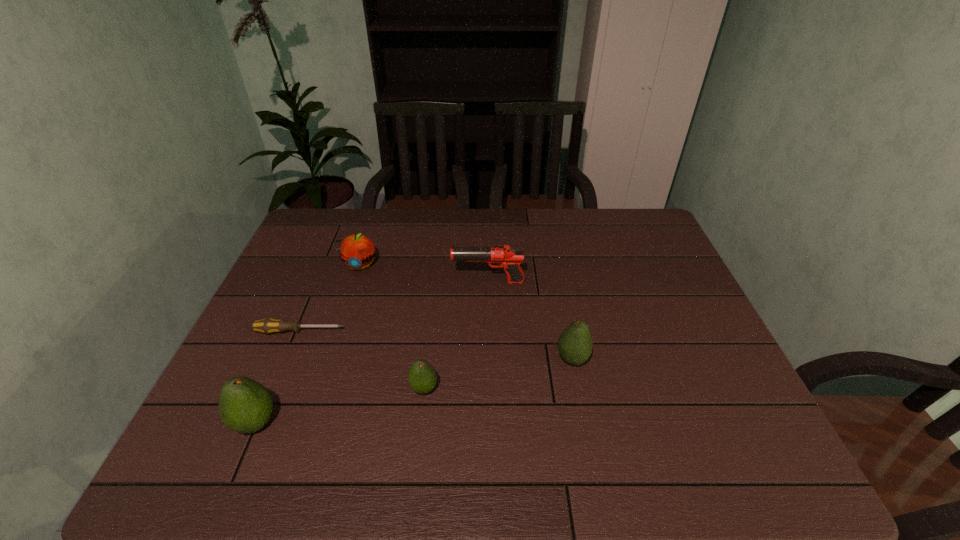
What are the coordinates of `blank region between the tallest avocado and the screwdriver` in the screenshot? It's located at (277, 377).

Find the location of a particular element. vacant area that lies between the shortest object and the fifth object from left to right is located at coordinates [394, 307].

This screenshot has height=540, width=960. In order to click on free space between the leftmost avocado and the third farthest object in this screenshot , I will do `click(277, 377)`.

Locate an element on the screen. empty location between the leftmost avocado and the second farthest avocado is located at coordinates (340, 406).

I want to click on empty location between the gun and the fourth farthest object, so click(530, 320).

What are the coordinates of `vacant area that lies between the nearest avocado and the screwdriver` in the screenshot? It's located at (277, 377).

Find the location of a particular element. The image size is (960, 540). free space between the second shortest avocado and the second farthest object is located at coordinates (530, 320).

You are a GUI agent. You are given a task and a screenshot of the screen. Output one action in this format:
    pyautogui.click(x=<x>, y=<y>)
    Task: Click on the free area in between the fifth farthest object and the gun
    The image size is (960, 540).
    Given the screenshot: What is the action you would take?
    pyautogui.click(x=456, y=335)

Locate which object is the fourth closest to the screwdriver. Please provide its 2D coordinates. Your answer should be formatted as a tuple, i.e. [(x, y)], where the tuple contains the x and y coordinates of a point satisfying the conditions above.

[(505, 256)]

Find the location of `the second closest object to the third nearest object`. the second closest object to the third nearest object is located at coordinates click(422, 377).